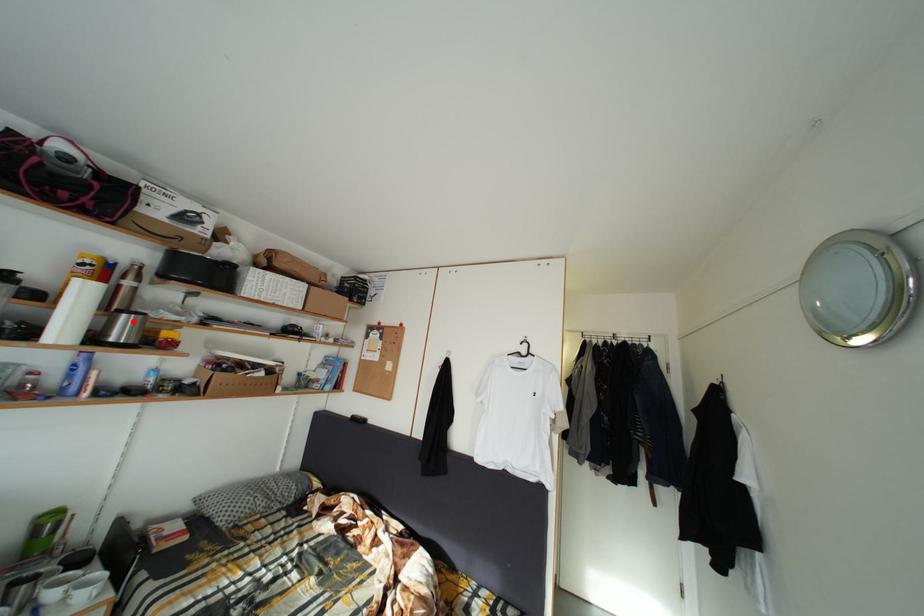
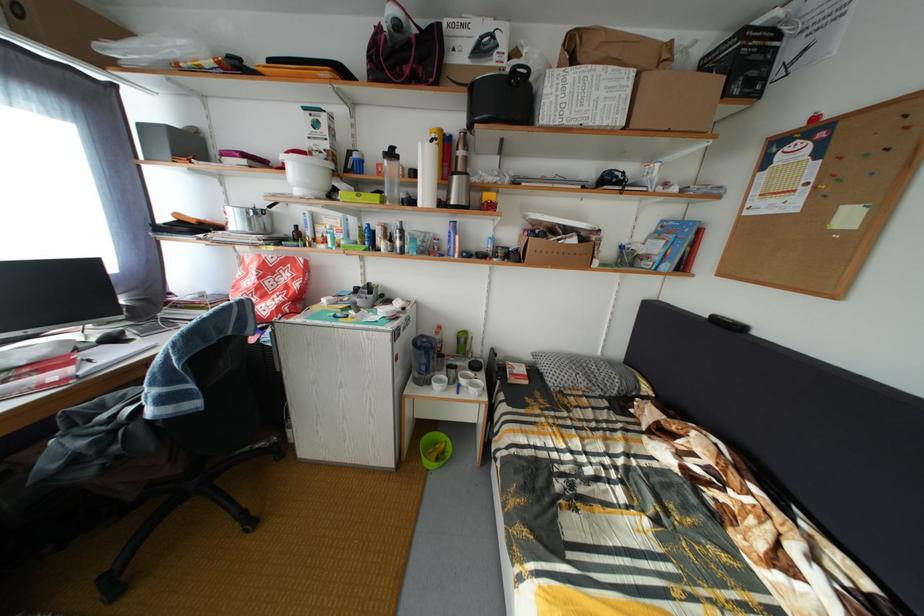
Find the pixel in the second image that matches the highlighted location in the first image.

(464, 184)